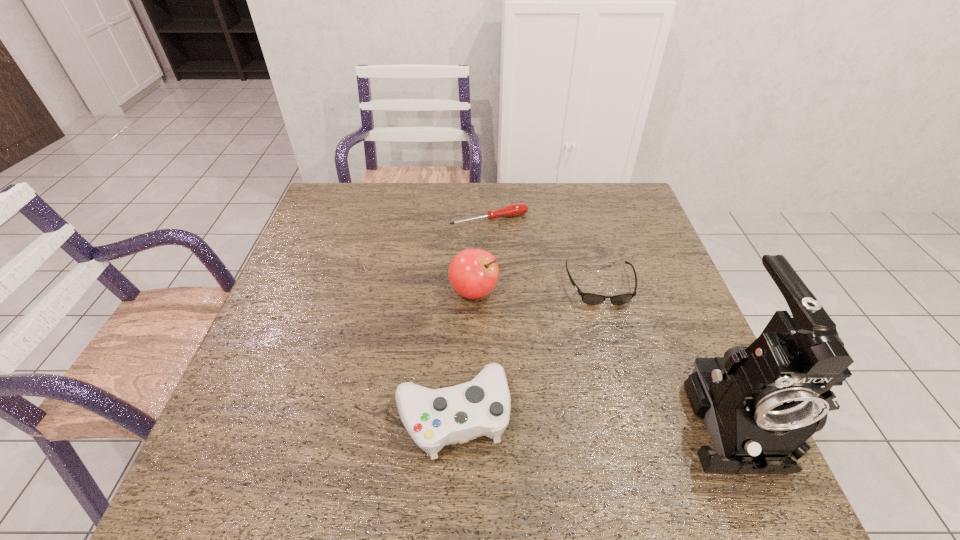
Point out which object is positioned as the second nearest to the third tallest object. Please provide its 2D coordinates. Your answer should be formatted as a tuple, i.e. [(x, y)], where the tuple contains the x and y coordinates of a point satisfying the conditions above.

[(589, 298)]

I want to click on free space that satisfies the following two spatial constraints: 1. on the back side of the sunglasses; 2. on the right side of the third shortest object, so click(459, 286).